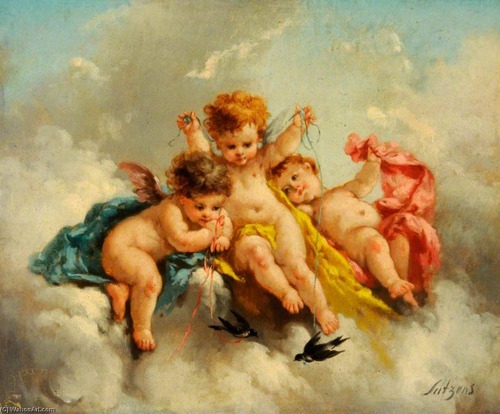
Find the location of a particular element. This screenshot has height=414, width=500. red cloth is located at coordinates (416, 218).